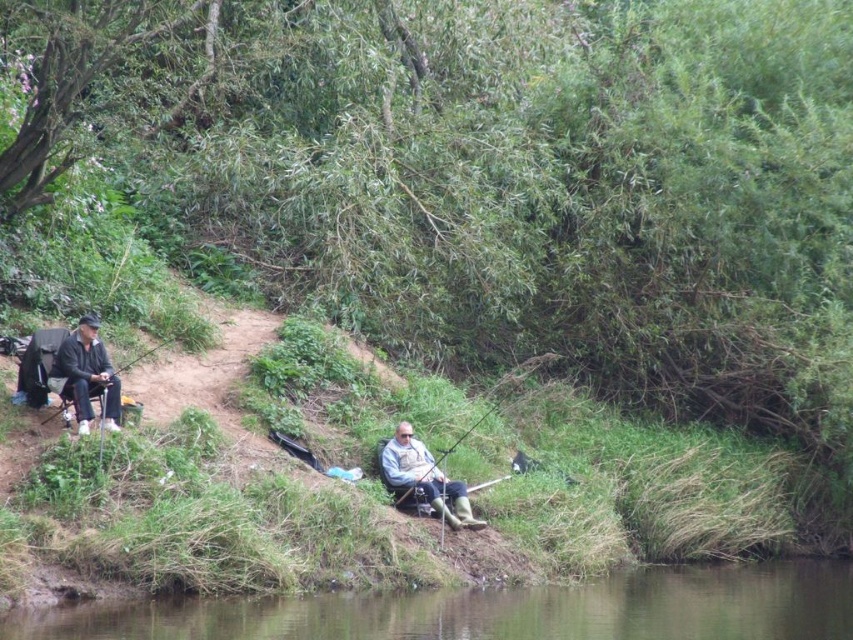
From the picture: You are a photographer trying to capture a clear shot of the matte black jacket at left and the matte black fishing rod at left. Given that your camera has a depth of field that can sharply focus on objects within a 0.5 inch range, will both objects remain in focus simultaneously?

The matte black jacket at left is only 0.62 inches away from the matte black fishing rod at left, which exceeds the camera sensor depth of field range of 0.5 inches. Therefore, both objects cannot be in focus at the same time.

You are standing at the point labeled point (74, 378) and want to move to the point labeled point (447, 609). Given that you can only walk through the open space between the two points, which direction should you head to reach your destination?

To move from point (74, 378) to point (447, 609), you should head towards the direction where point (447, 609) is closer to the viewer since it is located in front of point (74, 378).